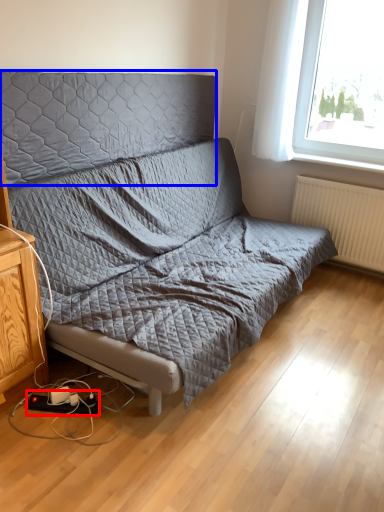
Question: Which point is further to the camera, equipment (highlighted by a red box) or headboard (highlighted by a blue box)?

Choices:
 (A) equipment
 (B) headboard

Answer: (A)